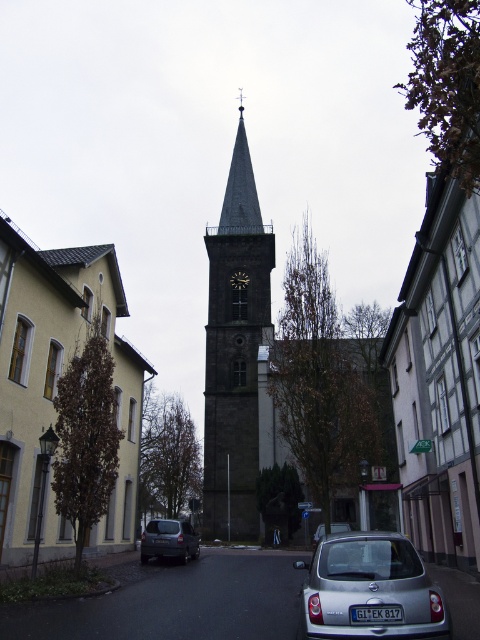
Question: Which point appears closest to the camera in this image?

Choices:
 (A) (137, 364)
 (B) (146, 548)
 (C) (247, 276)
 (D) (388, 563)

Answer: (D)

Question: Estimate the real-world distances between objects in this image. Which object is farther from the gold metallic clock at center?

Choices:
 (A) silver metallic car at center
 (B) matte black van at center
 (C) yellow stucco building at left
 (D) silver metallic hatchback at center

Answer: (D)

Question: Does silver metallic hatchback at center have a greater width compared to gold metallic clock at center?

Choices:
 (A) no
 (B) yes

Answer: (B)

Question: Which point appears closest to the camera in this image?

Choices:
 (A) (424, 364)
 (B) (247, 285)
 (C) (122, 522)

Answer: (A)

Question: Is yellow stucco building at left below dark gray stone clock tower at center?

Choices:
 (A) no
 (B) yes

Answer: (B)

Question: Is silver metallic car at center to the left of gold metallic clock at center from the viewer's perspective?

Choices:
 (A) yes
 (B) no

Answer: (B)